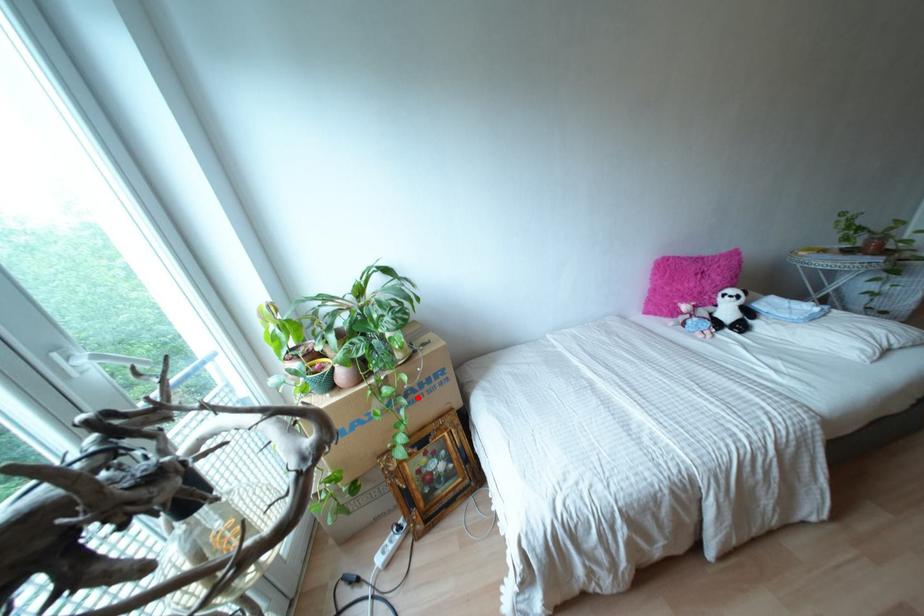
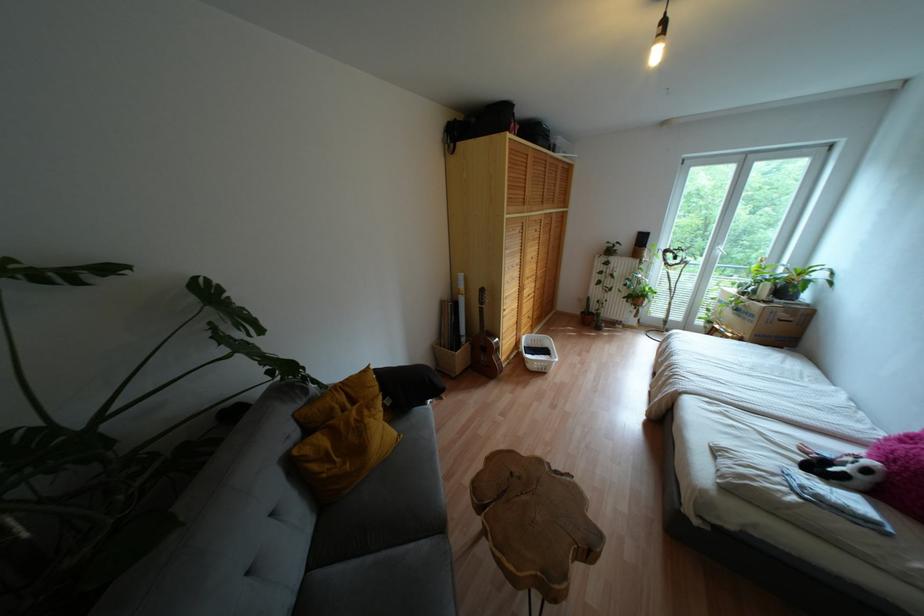
Question: A red point is marked in image1. In image2, is the corresponding 3D point closer to the camera or farther? Reply with the corresponding letter.

Choices:
 (A) The corresponding 3D point is closer.
 (B) The corresponding 3D point is farther.

Answer: (A)